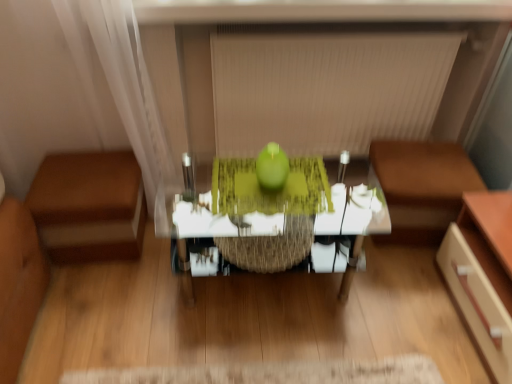
The width and height of the screenshot is (512, 384). What do you see at coordinates (272, 168) in the screenshot?
I see `green matte apple at center` at bounding box center [272, 168].

The width and height of the screenshot is (512, 384). I want to click on brown leather couch at right, the 1th furniture from the right, so click(x=422, y=187).

Locate an element on the screen. The width and height of the screenshot is (512, 384). brown leather ottoman at left, which is the 2th furniture from right to left is located at coordinates 89,206.

I want to click on translucent glass table at center, so click(x=347, y=231).

At what (x,y) coordinates should I click in order to perform the action: click on green matte apple at center. Please return your answer as a coordinate pair (x, y). This screenshot has height=384, width=512. Looking at the image, I should click on (272, 168).

Which object is positioned more to the left, beige fabric blind at upper center or green matte apple at center?

Positioned to the left is green matte apple at center.

Is beige fabric blind at upper center positioned behind green matte apple at center?

Yes, beige fabric blind at upper center is further from the viewer.

Who is shorter, beige fabric blind at upper center or green matte apple at center?

With less height is green matte apple at center.

Is beige fabric blind at upper center wider or thinner than green matte apple at center?

Considering their sizes, beige fabric blind at upper center looks broader than green matte apple at center.

Is translucent glass table at center not close to brown leather couch at right, the 1th furniture from the right?

They are positioned close to each other.

Does point (315, 271) come behind point (395, 163)?

Yes, it is.

Is translucent glass table at center further to the viewer compared to brown leather couch at right, which ranks as the second furniture in left-to-right order?

No.

Based on their sizes in the image, would you say translucent glass table at center is bigger or smaller than brown leather couch at right, the 1th furniture from the right?

Considering their sizes, translucent glass table at center takes up more space than brown leather couch at right, the 1th furniture from the right.

Between green matte apple at center and translucent glass table at center, which one has more height?

Standing taller between the two is translucent glass table at center.

Does green matte apple at center turn towards translucent glass table at center?

No.

Do you think green matte apple at center is within translucent glass table at center, or outside of it?

green matte apple at center is located beyond the bounds of translucent glass table at center.

This screenshot has height=384, width=512. Identify the location of apple on the right of translucent glass table at center. (272, 168).

From the image's perspective, is brown leather ottoman at left, which is the 2th furniture from right to left, over beige fabric blind at upper center?

No, from the image's perspective, brown leather ottoman at left, which is the 2th furniture from right to left, is not over beige fabric blind at upper center.

Considering the relative sizes of brown leather ottoman at left, which is the first furniture in left-to-right order, and beige fabric blind at upper center in the image provided, is brown leather ottoman at left, which is the first furniture in left-to-right order, shorter than beige fabric blind at upper center?

Yes.

Does point (106, 243) lie behind point (419, 98)?

No, it is not.

Is beige fabric blind at upper center beside brown leather couch at right, which ranks as the second furniture in left-to-right order?

There is a gap between beige fabric blind at upper center and brown leather couch at right, which ranks as the second furniture in left-to-right order.

Does beige fabric blind at upper center lie in front of brown leather couch at right, which ranks as the second furniture in left-to-right order?

That is False.

Is point (341, 115) positioned behind point (413, 162)?

Yes, it is behind point (413, 162).

Is translucent glass table at center aimed at brown leather ottoman at left, which is the first furniture in left-to-right order?

No, translucent glass table at center is not oriented towards brown leather ottoman at left, which is the first furniture in left-to-right order.

Considering the relative positions of translucent glass table at center and brown leather ottoman at left, which is the first furniture in left-to-right order, in the image provided, is translucent glass table at center to the left of brown leather ottoman at left, which is the first furniture in left-to-right order, from the viewer's perspective?

In fact, translucent glass table at center is to the right of brown leather ottoman at left, which is the first furniture in left-to-right order.

Which object is more forward, translucent glass table at center or brown leather ottoman at left, which is the first furniture in left-to-right order?

translucent glass table at center.

Looking at this image, which is more to the right, green matte apple at center or beige fabric blind at upper center?

From the viewer's perspective, beige fabric blind at upper center appears more on the right side.

Looking at this image, how many degrees apart are the facing directions of green matte apple at center and beige fabric blind at upper center?

The facing directions of green matte apple at center and beige fabric blind at upper center are 0.595 degrees apart.

Based on their sizes in the image, would you say green matte apple at center is bigger or smaller than beige fabric blind at upper center?

green matte apple at center is smaller than beige fabric blind at upper center.

How far apart are green matte apple at center and beige fabric blind at upper center?

A distance of 23.44 inches exists between green matte apple at center and beige fabric blind at upper center.

Find the location of a particular element. Image resolution: width=512 pixels, height=384 pixels. blind below the green matte apple at center (from a real-world perspective) is located at coordinates (326, 90).

Where is `table in front of the brown leather couch at right, which ranks as the second furniture in left-to-right order`? The image size is (512, 384). table in front of the brown leather couch at right, which ranks as the second furniture in left-to-right order is located at coordinates (347, 231).

Based on their spatial positions, is translucent glass table at center or green matte apple at center closer to brown leather ottoman at left, which is the 2th furniture from right to left?

translucent glass table at center is positioned closer to the anchor brown leather ottoman at left, which is the 2th furniture from right to left.

When comparing their distances from brown leather ottoman at left, which is the first furniture in left-to-right order, does brown leather couch at right, which ranks as the second furniture in left-to-right order, or beige fabric blind at upper center seem closer?

beige fabric blind at upper center is closer to brown leather ottoman at left, which is the first furniture in left-to-right order.

Estimate the real-world distances between objects in this image. Which object is closer to translucent glass table at center, green matte apple at center or brown leather couch at right, the 1th furniture from the right?

Based on the image, brown leather couch at right, the 1th furniture from the right, appears to be nearer to translucent glass table at center.

From the image, which object appears to be nearer to brown leather ottoman at left, which is the first furniture in left-to-right order, green matte apple at center or beige fabric blind at upper center?

The object closer to brown leather ottoman at left, which is the first furniture in left-to-right order, is green matte apple at center.

Looking at the image, which one is located closer to brown leather couch at right, which ranks as the second furniture in left-to-right order, green matte apple at center or translucent glass table at center?

translucent glass table at center is closer to brown leather couch at right, which ranks as the second furniture in left-to-right order.

Based on the photo, considering their positions, is brown leather ottoman at left, which is the first furniture in left-to-right order, positioned further to brown leather couch at right, the 1th furniture from the right, than translucent glass table at center?

brown leather ottoman at left, which is the first furniture in left-to-right order, is positioned further to the anchor brown leather couch at right, the 1th furniture from the right.

Which object lies further to the anchor point beige fabric blind at upper center, brown leather ottoman at left, which is the first furniture in left-to-right order, or green matte apple at center?

Based on the image, brown leather ottoman at left, which is the first furniture in left-to-right order, appears to be further to beige fabric blind at upper center.

Looking at this image, estimate the real-world distances between objects in this image. Which object is further from brown leather couch at right, which ranks as the second furniture in left-to-right order, green matte apple at center or brown leather ottoman at left, which is the first furniture in left-to-right order?

brown leather ottoman at left, which is the first furniture in left-to-right order.

This screenshot has width=512, height=384. In order to click on table between brown leather ottoman at left, which is the first furniture in left-to-right order, and brown leather couch at right, which ranks as the second furniture in left-to-right order, in the horizontal direction in this screenshot , I will do `click(347, 231)`.

The width and height of the screenshot is (512, 384). What are the coordinates of `blind between translucent glass table at center and brown leather couch at right, which ranks as the second furniture in left-to-right order, in the horizontal direction` in the screenshot? It's located at (326, 90).

Where is `apple between brown leather ottoman at left, which is the 2th furniture from right to left, and brown leather couch at right, which ranks as the second furniture in left-to-right order, from left to right`? apple between brown leather ottoman at left, which is the 2th furniture from right to left, and brown leather couch at right, which ranks as the second furniture in left-to-right order, from left to right is located at coordinates (272, 168).

I want to click on blind between green matte apple at center and brown leather couch at right, the 1th furniture from the right, in the horizontal direction, so click(x=326, y=90).